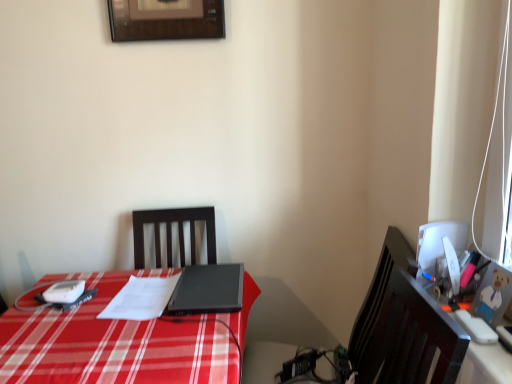
You are a GUI agent. You are given a task and a screenshot of the screen. Output one action in this format:
    pyautogui.click(x=<x>, y=<y>)
    Task: Click on the empty space that is ontop of black matte laptop at center (from a real-world perspective)
    
    Given the screenshot: What is the action you would take?
    pyautogui.click(x=207, y=282)